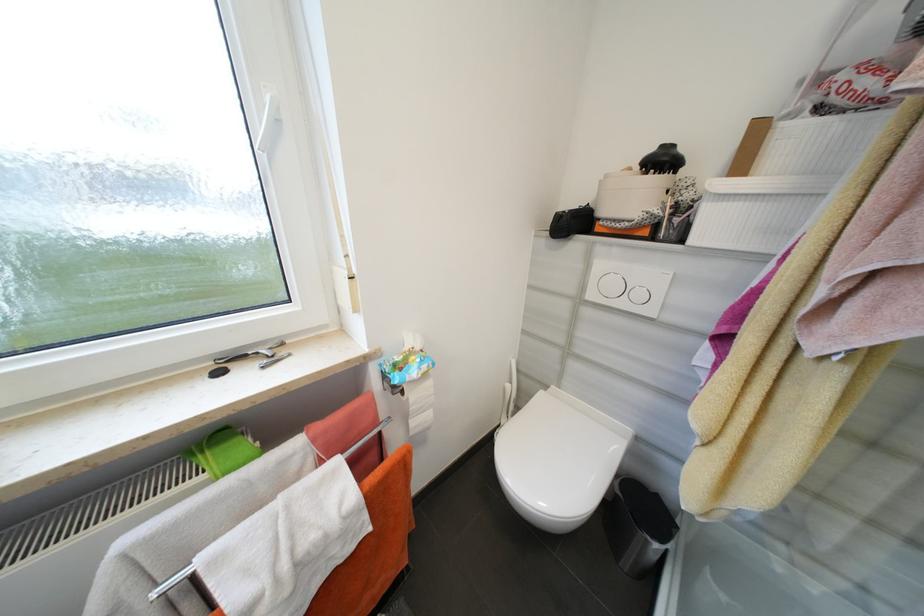
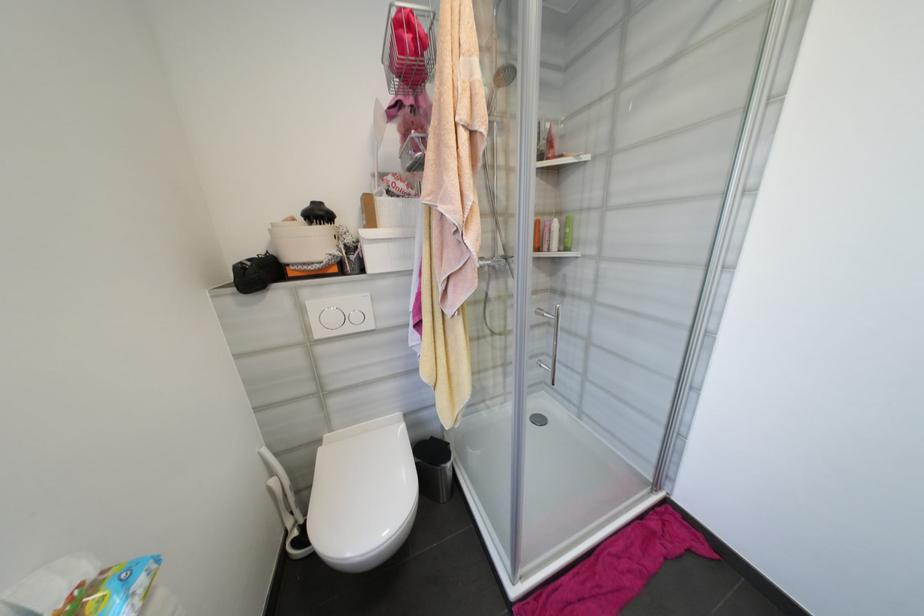
In the second image, find the point that corresponds to point 646,296 in the first image.

(361, 318)